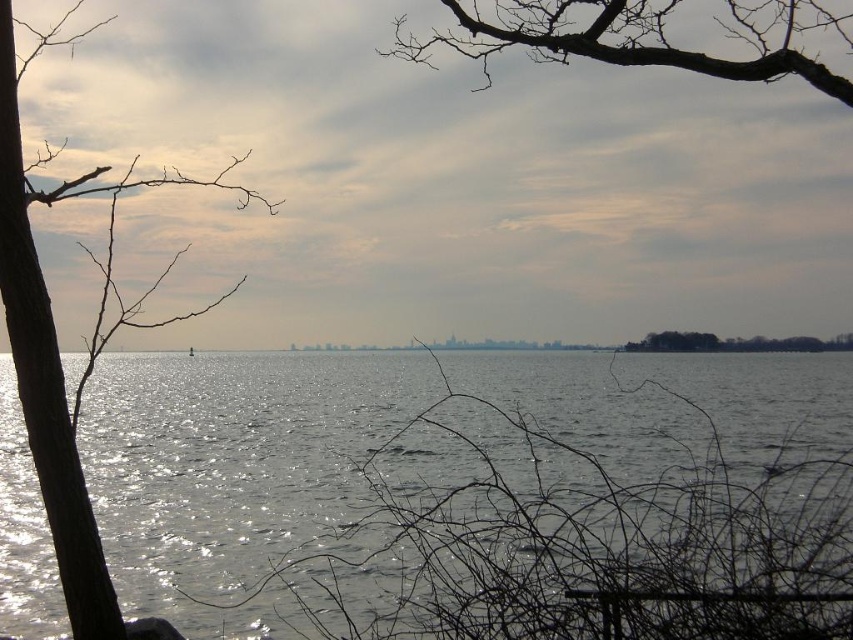
Who is lower down, glistening water at center or green leafy trees at right?

glistening water at center

Between point (190, 481) and point (766, 340), which one is positioned in front?

Point (190, 481) is more forward.

Locate an element on the screen. glistening water at center is located at coordinates (231, 467).

Consider the image. Is glistening water at center taller than brown/dry wood tree at left?

Incorrect, glistening water at center's height is not larger of brown/dry wood tree at left's.

Consider the image. Is glistening water at center bigger than brown/dry wood tree at left?

No, glistening water at center is not bigger than brown/dry wood tree at left.

What do you see at coordinates (231, 467) in the screenshot? The height and width of the screenshot is (640, 853). I see `glistening water at center` at bounding box center [231, 467].

Identify the location of glistening water at center. (231, 467).

Describe the element at coordinates (55, 348) in the screenshot. I see `brown/dry wood tree at left` at that location.

Is brown/dry wood tree at left shorter than green leafy trees at right?

In fact, brown/dry wood tree at left may be taller than green leafy trees at right.

What do you see at coordinates (55, 348) in the screenshot?
I see `brown/dry wood tree at left` at bounding box center [55, 348].

Locate an element on the screen. The width and height of the screenshot is (853, 640). brown/dry wood tree at left is located at coordinates (55, 348).